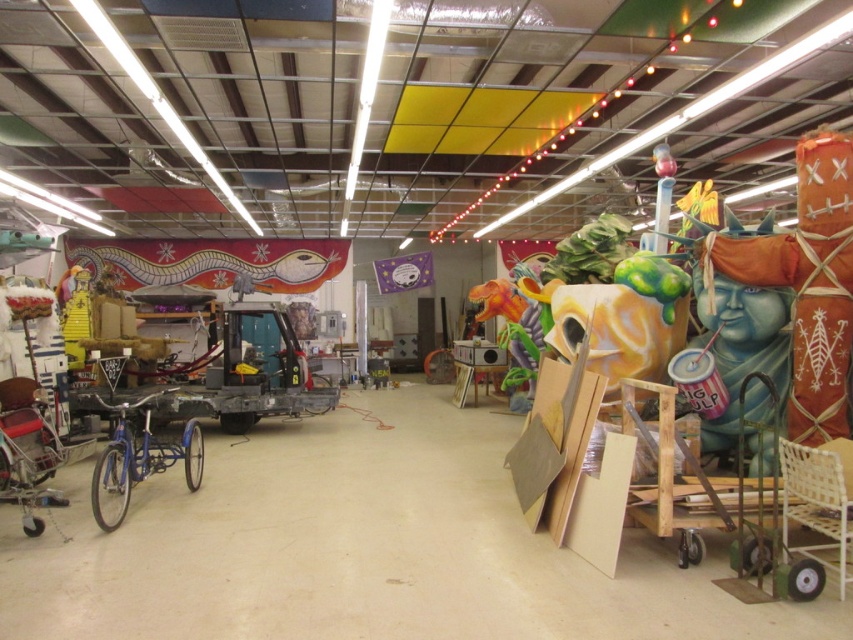
Looking at this image, can you confirm if blue painted statue at right is taller than shiny blue bicycle at lower left?

Indeed, blue painted statue at right has a greater height compared to shiny blue bicycle at lower left.

What do you see at coordinates (743, 353) in the screenshot?
I see `blue painted statue at right` at bounding box center [743, 353].

The height and width of the screenshot is (640, 853). What are the coordinates of `blue painted statue at right` in the screenshot? It's located at (743, 353).